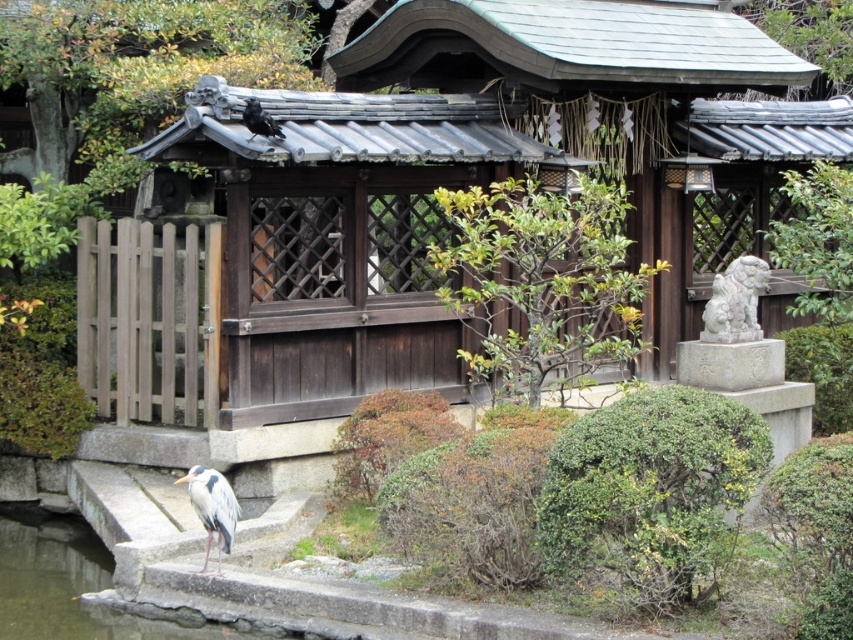
Is the position of white stone lion at right more distant than that of gray feathered heron at lower left?

Yes, it is behind gray feathered heron at lower left.

Between point (722, 314) and point (218, 541), which one is positioned in front?

Positioned in front is point (218, 541).

This screenshot has height=640, width=853. Find the location of `white stone lion at right`. white stone lion at right is located at coordinates (735, 301).

This screenshot has height=640, width=853. Find the location of `white stone lion at right`. white stone lion at right is located at coordinates (735, 301).

Is gray feathered heron at lower left closer to the viewer compared to shiny black crow at upper center?

Yes, gray feathered heron at lower left is closer to the viewer.

Does point (207, 467) lie behind point (248, 138)?

Yes, it is behind point (248, 138).

Find the location of a particular element. The height and width of the screenshot is (640, 853). gray feathered heron at lower left is located at coordinates [x=212, y=509].

Is white stone lion at right taller than shiny black crow at upper center?

Result: Yes.

Does white stone lion at right appear under shiny black crow at upper center?

Correct, white stone lion at right is located below shiny black crow at upper center.

Describe the element at coordinates (735, 301) in the screenshot. I see `white stone lion at right` at that location.

I want to click on white stone lion at right, so click(x=735, y=301).